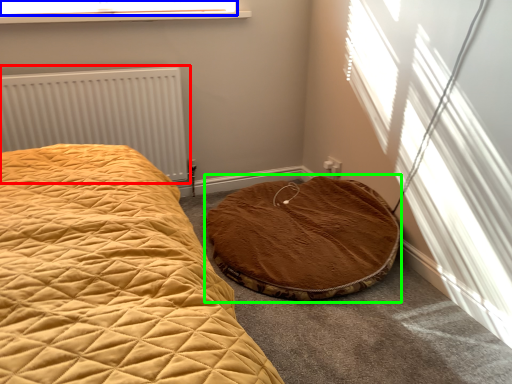
Question: Considering the real-world distances, which object is closest to radiator (highlighted by a red box)? window screen (highlighted by a blue box) or cat bed (highlighted by a green box).

Choices:
 (A) window screen
 (B) cat bed

Answer: (A)